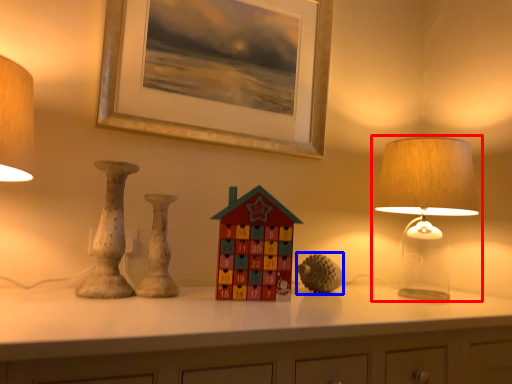
Question: Which point is further to the camera, lamp (highlighted by a red box) or toy (highlighted by a blue box)?

Choices:
 (A) lamp
 (B) toy

Answer: (B)